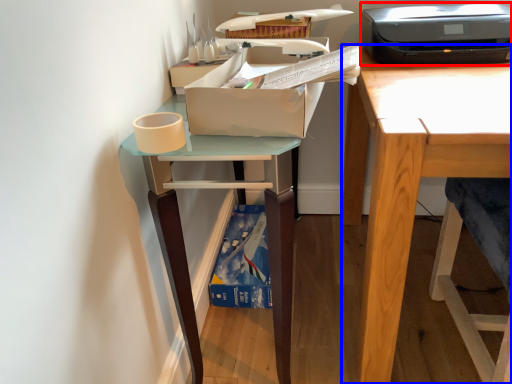
Question: Which object appears closest to the camera in this image, printer (highlighted by a red box) or desk (highlighted by a blue box)?

Choices:
 (A) printer
 (B) desk

Answer: (B)